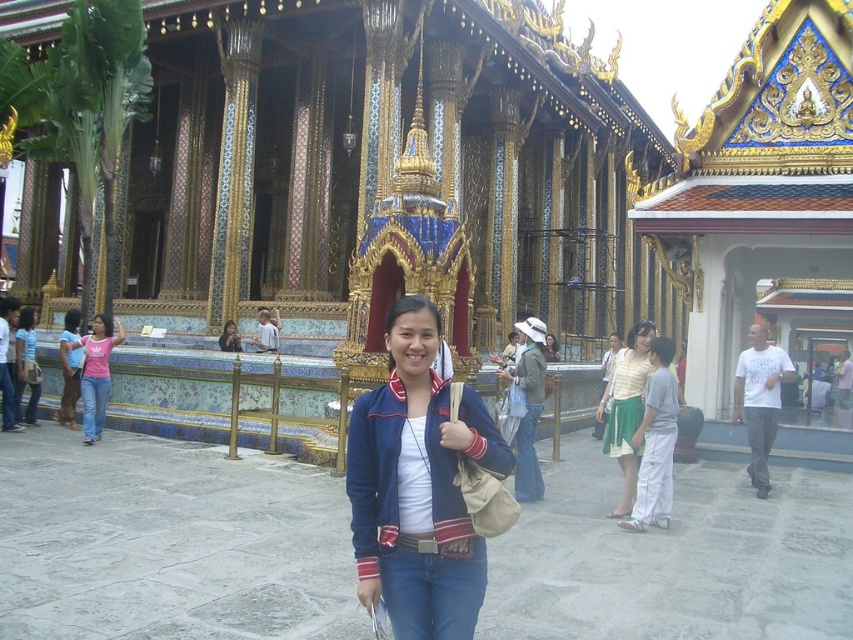
You are a photographer wanting to capture the woman wearing the navy blue jacket at center and the matte black jacket at center in a single shot. Which jacket is positioned to the right side of the other?

The navy blue jacket at center is to the right of the matte black jacket at center.

Consider the image. You are standing at the temple and want to take a photo of the two points mentioned. Which point is closer to you, point (x=755, y=150) or point (x=223, y=332)?

Point (x=755, y=150) is in front of point (x=223, y=332), so it is closer to you.